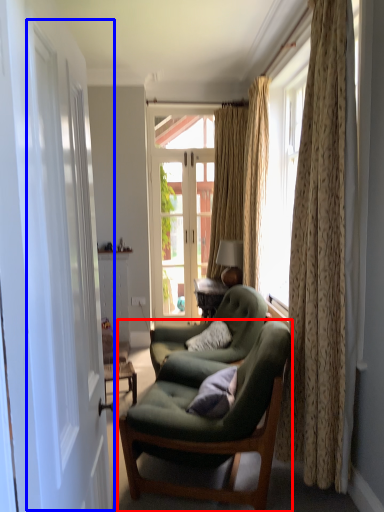
Question: Which object appears closest to the camera in this image, chair (highlighted by a red box) or screen door (highlighted by a blue box)?

Choices:
 (A) chair
 (B) screen door

Answer: (B)